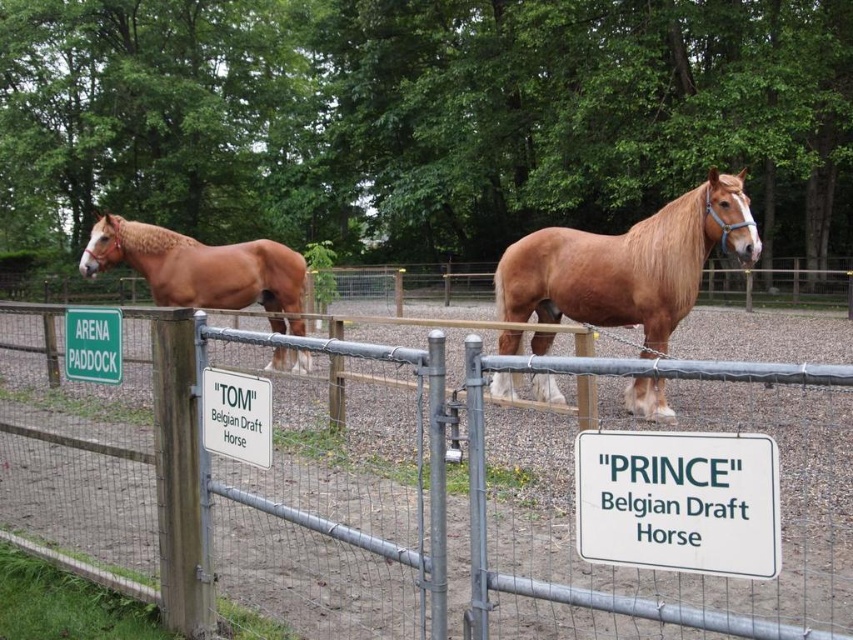
Who is more distant from viewer, (201, 497) or (105, 362)?

The point (105, 362) is more distant.

Image resolution: width=853 pixels, height=640 pixels. I want to click on metal fence at center, so click(x=433, y=490).

The height and width of the screenshot is (640, 853). I want to click on metal fence at center, so click(x=433, y=490).

Locate an element on the screen. This screenshot has height=640, width=853. golden brown mane at center is located at coordinates 628,264.

Is point (590, 307) behind point (119, 250)?

No, it is in front of (119, 250).

Find the location of a particular element. golden brown mane at center is located at coordinates (628, 264).

Is the position of metal fence at center more distant than that of golden brown horse at left?

No, metal fence at center is closer to the viewer.

Is point (283, 500) closer to viewer compared to point (236, 269)?

Yes, it is.

Locate an element on the screen. The height and width of the screenshot is (640, 853). metal fence at center is located at coordinates (433, 490).

Locate an element on the screen. The height and width of the screenshot is (640, 853). metal fence at center is located at coordinates coord(433,490).